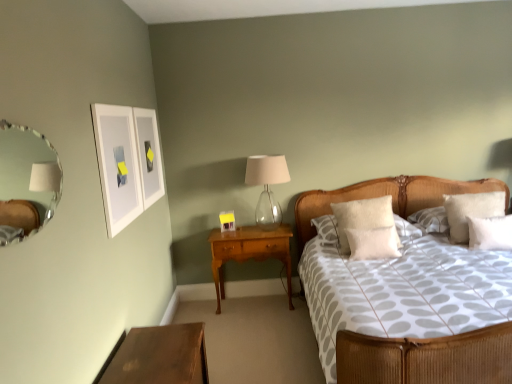
Image resolution: width=512 pixels, height=384 pixels. What are the coordinates of `clear glass table lamp at center` in the screenshot? It's located at (267, 187).

I want to click on white soft pillow at right, which ranks as the 2th pillow in right-to-left order, so click(490, 233).

What do you see at coordinates (26, 182) in the screenshot? I see `clear glass mirror at upper left` at bounding box center [26, 182].

What is the approximate height of wooden nightstand at lower left, acting as the 1th nightstand starting from the left?

The height of wooden nightstand at lower left, acting as the 1th nightstand starting from the left, is 16.84 inches.

Locate an element on the screen. wooden nightstand at lower left, the second nightstand positioned from the right is located at coordinates (158, 356).

Locate an element on the screen. The width and height of the screenshot is (512, 384). white fluffy pillow at center, the first pillow from the left is located at coordinates (367, 228).

Find the location of a particular element. Image resolution: width=512 pixels, height=384 pixels. clear glass table lamp at center is located at coordinates pyautogui.click(x=267, y=187).

Considering the sizes of white fluffy pillow at center, positioned as the 4th pillow in right-to-left order, and white fluffy pillow at upper right, which is the 4th pillow in left-to-right order, in the image, is white fluffy pillow at center, positioned as the 4th pillow in right-to-left order, wider or thinner than white fluffy pillow at upper right, which is the 4th pillow in left-to-right order,?

Considering their sizes, white fluffy pillow at center, positioned as the 4th pillow in right-to-left order, looks slimmer than white fluffy pillow at upper right, which is the 4th pillow in left-to-right order.

Can you confirm if white fluffy pillow at center, the first pillow from the left, is positioned to the left of white fluffy pillow at upper right, which is the 4th pillow in left-to-right order?

Yes.

Considering the sizes of white fluffy pillow at center, the first pillow from the left, and white fluffy pillow at upper right, the 1th pillow positioned from the right, in the image, is white fluffy pillow at center, the first pillow from the left, bigger or smaller than white fluffy pillow at upper right, the 1th pillow positioned from the right,?

In the image, white fluffy pillow at center, the first pillow from the left, appears to be larger than white fluffy pillow at upper right, the 1th pillow positioned from the right.

Is white fluffy pillow at center, the first pillow from the left, not close to white fluffy pillow at upper right, the 1th pillow positioned from the right?

No, white fluffy pillow at center, the first pillow from the left, is in close proximity to white fluffy pillow at upper right, the 1th pillow positioned from the right.

Consider the image. Is clear glass table lamp at center positioned before wooden nightstand at lower left, marked as the first nightstand in a front-to-back arrangement?

No, clear glass table lamp at center is further to the viewer.

Considering the positions of objects clear glass table lamp at center and wooden nightstand at lower left, the second nightstand positioned from the right, in the image provided, who is more to the left, clear glass table lamp at center or wooden nightstand at lower left, the second nightstand positioned from the right,?

From the viewer's perspective, wooden nightstand at lower left, the second nightstand positioned from the right, appears more on the left side.

Between clear glass table lamp at center and wooden nightstand at lower left, acting as the 1th nightstand starting from the left, which one has larger size?

Bigger between the two is wooden nightstand at lower left, acting as the 1th nightstand starting from the left.

Where is `table lamp behind the wooden nightstand at lower left, marked as the first nightstand in a front-to-back arrangement`? The width and height of the screenshot is (512, 384). table lamp behind the wooden nightstand at lower left, marked as the first nightstand in a front-to-back arrangement is located at coordinates (267, 187).

From the image's perspective, relative to woven wood bed at center, is clear glass mirror at upper left above or below?

clear glass mirror at upper left is above woven wood bed at center.

Is point (30, 131) positioned behind point (353, 334)?

That is False.

Considering the sizes of clear glass mirror at upper left and woven wood bed at center in the image, is clear glass mirror at upper left taller or shorter than woven wood bed at center?

clear glass mirror at upper left is shorter than woven wood bed at center.

Is wooden nightstand at lower left, acting as the 1th nightstand starting from the left, wider or thinner than clear glass mirror at upper left?

Considering their sizes, wooden nightstand at lower left, acting as the 1th nightstand starting from the left, looks broader than clear glass mirror at upper left.

Is point (198, 348) closer or farther from the camera than point (9, 240)?

Point (198, 348) is farther from the camera than point (9, 240).

Is wooden nightstand at lower left, marked as the first nightstand in a front-to-back arrangement, positioned before clear glass mirror at upper left?

No.

Between white fluffy pillow at upper right, which is the 4th pillow in left-to-right order, and wooden nightstand at lower left, marked as the first nightstand in a front-to-back arrangement, which one has larger width?

wooden nightstand at lower left, marked as the first nightstand in a front-to-back arrangement.

From the image's perspective, which is below, white fluffy pillow at upper right, the 1th pillow positioned from the right, or wooden nightstand at lower left, marked as the first nightstand in a front-to-back arrangement?

wooden nightstand at lower left, marked as the first nightstand in a front-to-back arrangement.

From a real-world perspective, is white fluffy pillow at upper right, which is the 4th pillow in left-to-right order, under wooden nightstand at lower left, the second nightstand positioned from the right?

No.

Is there a large distance between white fluffy pillow at upper right, the 1th pillow positioned from the right, and wooden nightstand at lower left, marked as the first nightstand in a front-to-back arrangement?

Yes, white fluffy pillow at upper right, the 1th pillow positioned from the right, and wooden nightstand at lower left, marked as the first nightstand in a front-to-back arrangement, are located far from each other.

Locate an element on the screen. The width and height of the screenshot is (512, 384). table lamp behind the white soft pillow at right, which ranks as the 2th pillow in right-to-left order is located at coordinates (267, 187).

Could you tell me if clear glass table lamp at center is facing white soft pillow at right, which ranks as the 2th pillow in right-to-left order?

No.

Considering the positions of objects clear glass table lamp at center and white soft pillow at right, which ranks as the 2th pillow in right-to-left order, in the image provided, who is in front, clear glass table lamp at center or white soft pillow at right, which ranks as the 2th pillow in right-to-left order,?

white soft pillow at right, which ranks as the 2th pillow in right-to-left order, is more forward.

Is there a large distance between clear glass table lamp at center and white soft pillow at right, positioned as the 3th pillow in left-to-right order?

Yes, clear glass table lamp at center is far from white soft pillow at right, positioned as the 3th pillow in left-to-right order.

From the image's perspective, is white soft pillow at center, the 2th pillow positioned from the left, positioned above or below clear glass mirror at upper left?

white soft pillow at center, the 2th pillow positioned from the left, is below clear glass mirror at upper left.

Considering the sizes of objects white soft pillow at center, the 2th pillow positioned from the left, and clear glass mirror at upper left in the image provided, who is thinner, white soft pillow at center, the 2th pillow positioned from the left, or clear glass mirror at upper left?

clear glass mirror at upper left.

Is white soft pillow at center, which is counted as the 3th pillow, starting from the right, beside clear glass mirror at upper left?

white soft pillow at center, which is counted as the 3th pillow, starting from the right, is not next to clear glass mirror at upper left, and they're not touching.

Image resolution: width=512 pixels, height=384 pixels. In order to click on pillow above the white fluffy pillow at center, the first pillow from the left (from the image's perspective) in this screenshot , I will do tap(471, 210).

Identify the location of nightstand that is the 2nd one when counting downward from the clear glass table lamp at center (from the image's perspective). The height and width of the screenshot is (384, 512). (158, 356).

Considering their positions, is white matte picture frame at upper left positioned closer to white soft pillow at center, which is counted as the 3th pillow, starting from the right, than white fluffy pillow at upper right, which is the 4th pillow in left-to-right order?

The object closer to white soft pillow at center, which is counted as the 3th pillow, starting from the right, is white fluffy pillow at upper right, which is the 4th pillow in left-to-right order.

Based on their spatial positions, is white soft pillow at center, the 2th pillow positioned from the left, or clear glass table lamp at center closer to white fluffy pillow at upper right, the 1th pillow positioned from the right?

white soft pillow at center, the 2th pillow positioned from the left.

Based on their spatial positions, is clear glass mirror at upper left or wooden nightstand at lower left, acting as the 1th nightstand starting from the left, further from white fluffy pillow at upper right, which is the 4th pillow in left-to-right order?

clear glass mirror at upper left.

Consider the image. Considering their positions, is wooden nightstand at lower left, acting as the 1th nightstand starting from the left, positioned closer to woven wood bed at center than white soft pillow at right, which ranks as the 2th pillow in right-to-left order?

Among the two, white soft pillow at right, which ranks as the 2th pillow in right-to-left order, is located nearer to woven wood bed at center.

Based on their spatial positions, is white soft pillow at right, positioned as the 3th pillow in left-to-right order, or wooden nightstand at lower left, the second nightstand positioned from the right, further from wooden nightstand at center, marked as the 2th nightstand in a front-to-back arrangement?

white soft pillow at right, positioned as the 3th pillow in left-to-right order.

Based on their spatial positions, is clear glass mirror at upper left or white fluffy pillow at center, the first pillow from the left, further from white soft pillow at center, the 2th pillow positioned from the left?

clear glass mirror at upper left is further to white soft pillow at center, the 2th pillow positioned from the left.

Considering their positions, is wooden nightstand at lower left, the second nightstand positioned from the right, positioned further to white fluffy pillow at upper right, which is the 4th pillow in left-to-right order, than white soft pillow at right, which ranks as the 2th pillow in right-to-left order?

Based on the image, wooden nightstand at lower left, the second nightstand positioned from the right, appears to be further to white fluffy pillow at upper right, which is the 4th pillow in left-to-right order.

Based on their spatial positions, is white fluffy pillow at center, the first pillow from the left, or white matte picture frame at upper left closer to white fluffy pillow at upper right, the 1th pillow positioned from the right?

Among the two, white fluffy pillow at center, the first pillow from the left, is located nearer to white fluffy pillow at upper right, the 1th pillow positioned from the right.

Find the location of a particular element. This screenshot has width=512, height=384. bed between white matte picture frame at upper left and white fluffy pillow at upper right, the 1th pillow positioned from the right is located at coordinates (426, 358).

The width and height of the screenshot is (512, 384). Identify the location of bed between clear glass mirror at upper left and wooden nightstand at center, placed as the 2th nightstand when sorted from left to right, in the front-back direction. (426, 358).

Find the location of a particular element. The image size is (512, 384). pillow between white matte picture frame at upper left and white soft pillow at center, which is counted as the 3th pillow, starting from the right is located at coordinates (367, 228).

Find the location of a particular element. pillow situated between clear glass table lamp at center and white soft pillow at center, the 2th pillow positioned from the left, from left to right is located at coordinates (367, 228).